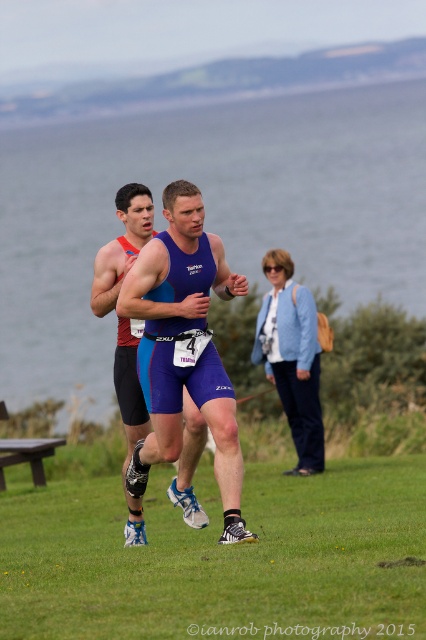
Who is higher up, green grass at lower center or blue matte triathlon suit at center?

Positioned higher is blue matte triathlon suit at center.

Between point (339, 486) and point (196, 298), which one is positioned behind?

The point (339, 486) is more distant.

Where is `green grass at lower center`? The image size is (426, 640). green grass at lower center is located at coordinates (218, 557).

Who is positioned more to the right, transparent water at center or blue fabric tank top at center?

Positioned to the right is blue fabric tank top at center.

Which is in front, point (36, 252) or point (299, 433)?

Point (299, 433) is more forward.

Identify the location of transparent water at center. The width and height of the screenshot is (426, 640). (207, 212).

Who is more forward, (210, 243) or (276, 374)?

Positioned in front is point (210, 243).

Does blue matte triathlon suit at center have a larger size compared to blue fabric tank top at center?

Indeed, blue matte triathlon suit at center has a larger size compared to blue fabric tank top at center.

Between point (187, 346) and point (276, 272), which one is positioned behind?

The point (276, 272) is behind.

Where is `blue matte triathlon suit at center`? blue matte triathlon suit at center is located at coordinates (184, 346).